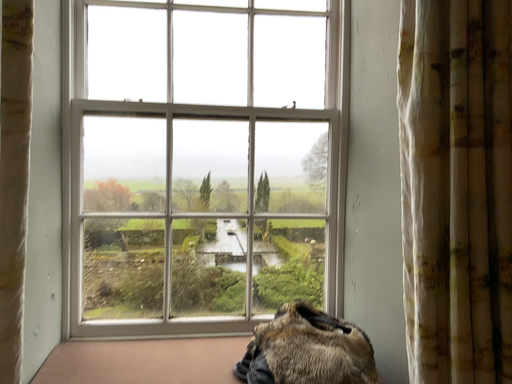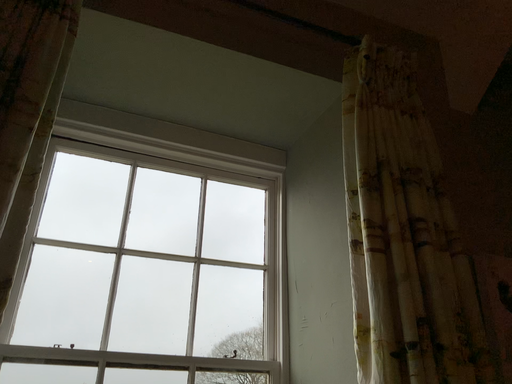
Question: Which way did the camera rotate in the video?

Choices:
 (A) rotated right
 (B) rotated left

Answer: (A)